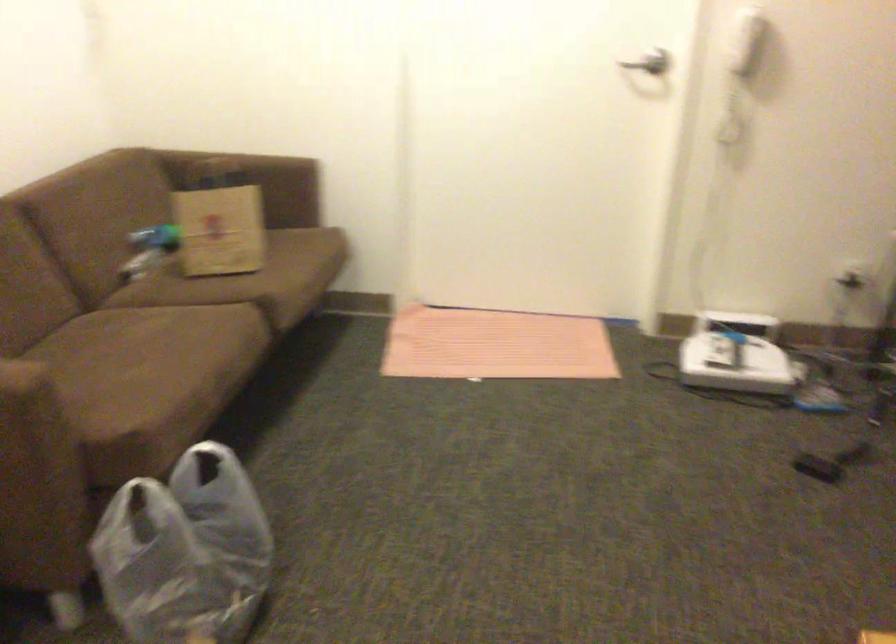
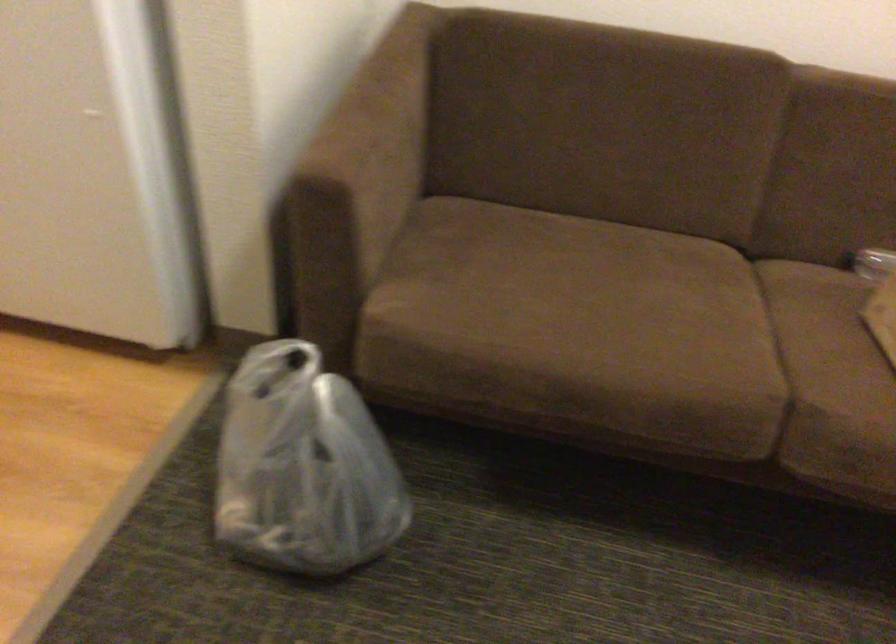
Locate, in the second image, the point that corresponds to the point at 190,554 in the first image.

(304, 467)